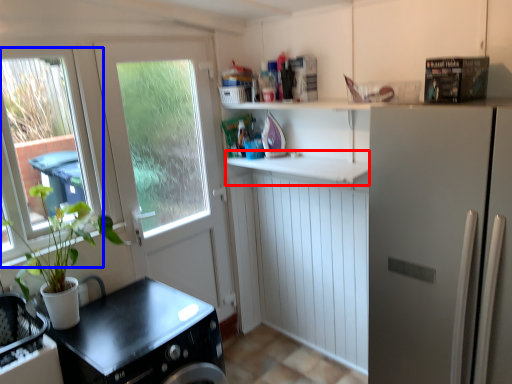
Question: Which object appears farthest to the camera in this image, counter top (highlighted by a red box) or window (highlighted by a blue box)?

Choices:
 (A) counter top
 (B) window

Answer: (A)